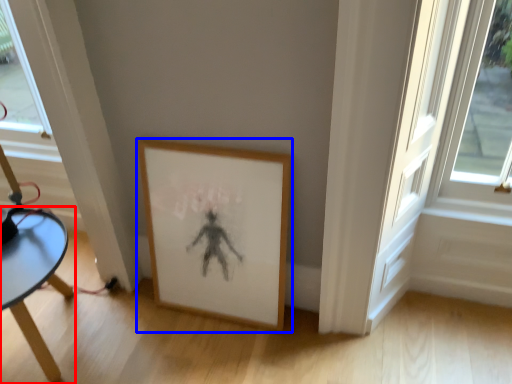
Question: Which object is closer to the camera taking this photo, table (highlighted by a red box) or picture frame (highlighted by a blue box)?

Choices:
 (A) table
 (B) picture frame

Answer: (A)